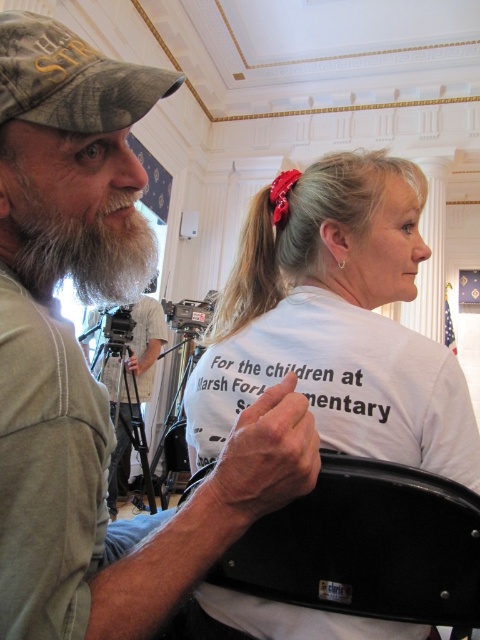
Which is more to the right, graywoollybeard at left or camouflage fabric baseball cap at upper left?

camouflage fabric baseball cap at upper left is more to the right.

Does graywoollybeard at left have a greater height compared to camouflage fabric baseball cap at upper left?

Yes.

Where is `graywoollybeard at left`? The image size is (480, 640). graywoollybeard at left is located at coordinates (75, 218).

Between point (61, 628) and point (355, 368), which one is positioned behind?

The point (355, 368) is behind.

Is point (61, 104) positioned behind point (292, 362)?

No, it is in front of (292, 362).

Is point (120, 161) positioned behind point (218, 392)?

No, it is not.

Identify the location of camouflage fabric hat at upper left. [x=84, y=360].

Can you confirm if black matte tripod at center is bigger than black plastic video camera at center?

Correct, black matte tripod at center is larger in size than black plastic video camera at center.

Is point (153, 381) farther from camera compared to point (212, 308)?

No.

Where is `black matte tripod at center`? Image resolution: width=480 pixels, height=640 pixels. black matte tripod at center is located at coordinates click(x=131, y=387).